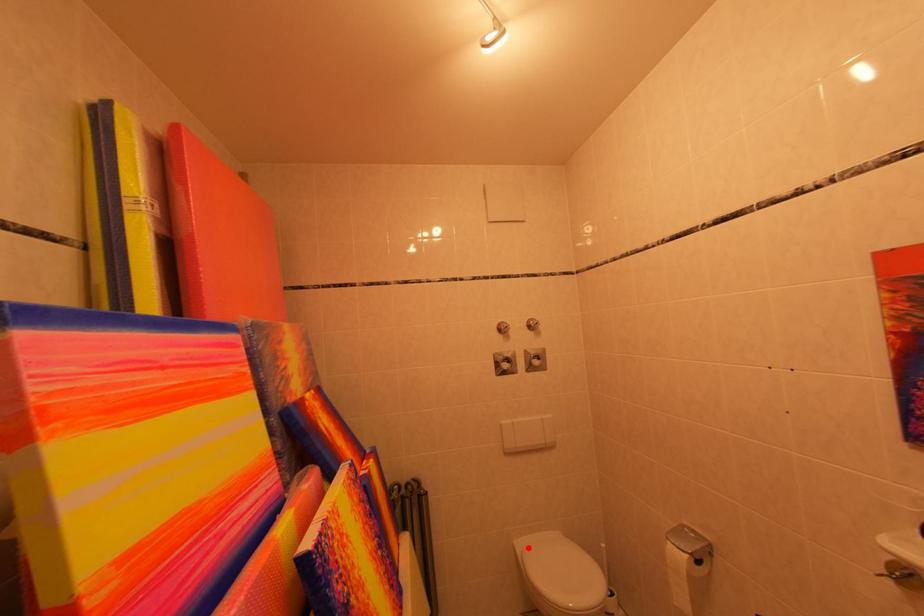
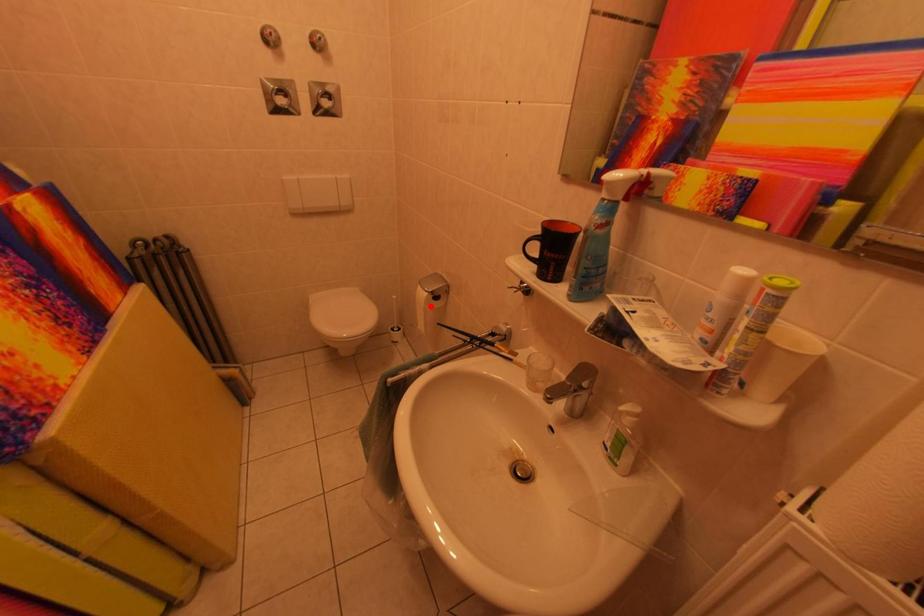
I am providing you with two images of the same scene from different viewpoints. A red point is marked on the first image and another point is marked on the second image. Is the red point in image1 aligned with the point shown in image2?

No